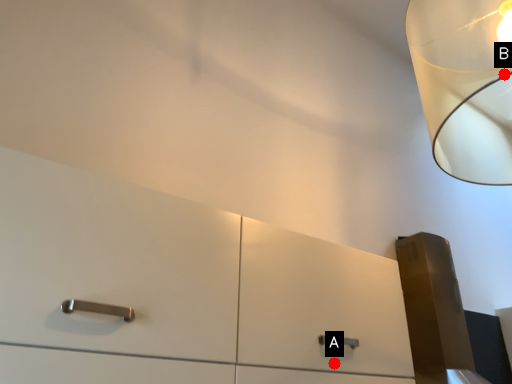
Question: Two points are circled on the image, labeled by A and B beside each circle. Which point appears farthest from the camera in this image?

Choices:
 (A) A is further
 (B) B is further

Answer: (B)